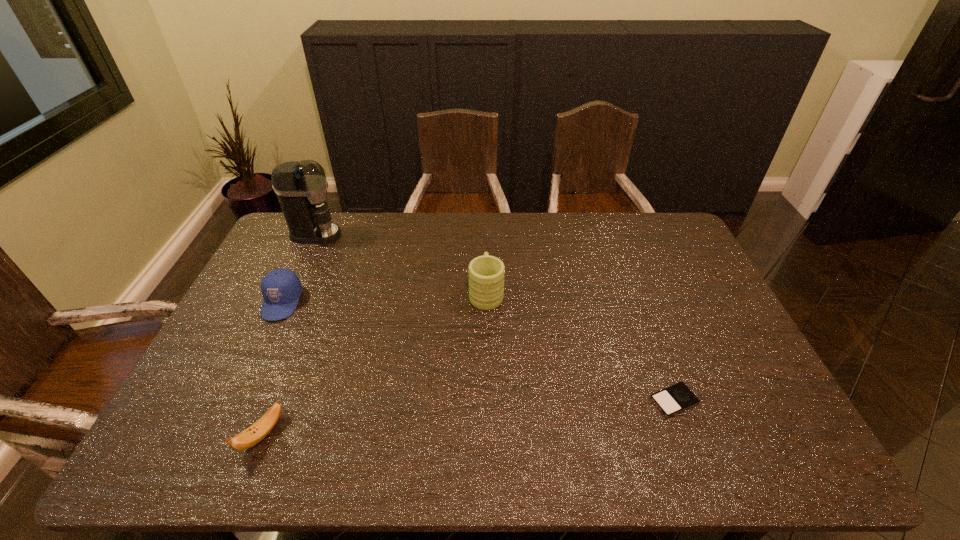
Image resolution: width=960 pixels, height=540 pixels. I want to click on the tallest object, so click(301, 187).

Locate an element on the screen. The image size is (960, 540). the farthest object is located at coordinates (301, 187).

Locate an element on the screen. the fourth object from left to right is located at coordinates (486, 280).

I want to click on mug, so click(x=486, y=280).

I want to click on cap, so click(x=281, y=288).

What are the coordinates of `the second shortest object` in the screenshot? It's located at (253, 435).

Identify the location of iPod. (678, 397).

You are a GUI agent. You are given a task and a screenshot of the screen. Output one action in this format:
    pyautogui.click(x=<x>, y=<y>)
    Task: Click on the rightmost object
    The image size is (960, 540).
    Given the screenshot: What is the action you would take?
    pyautogui.click(x=678, y=397)

Image resolution: width=960 pixels, height=540 pixels. I want to click on vacant space located 0.180m place cup under the spout of the coffee maker, so click(390, 234).

What are the coordinates of `free region located on the side of the mug with the handle` in the screenshot? It's located at (485, 235).